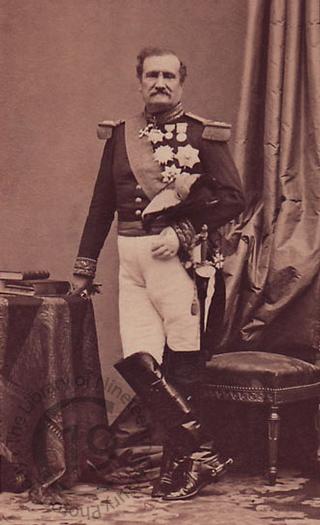
The width and height of the screenshot is (320, 525). I want to click on table, so click(29, 301).